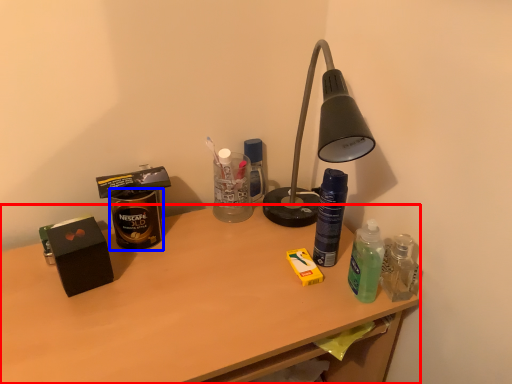
Question: Which point is closer to the camera, desk (highlighted by a red box) or beverage (highlighted by a blue box)?

Choices:
 (A) desk
 (B) beverage

Answer: (A)